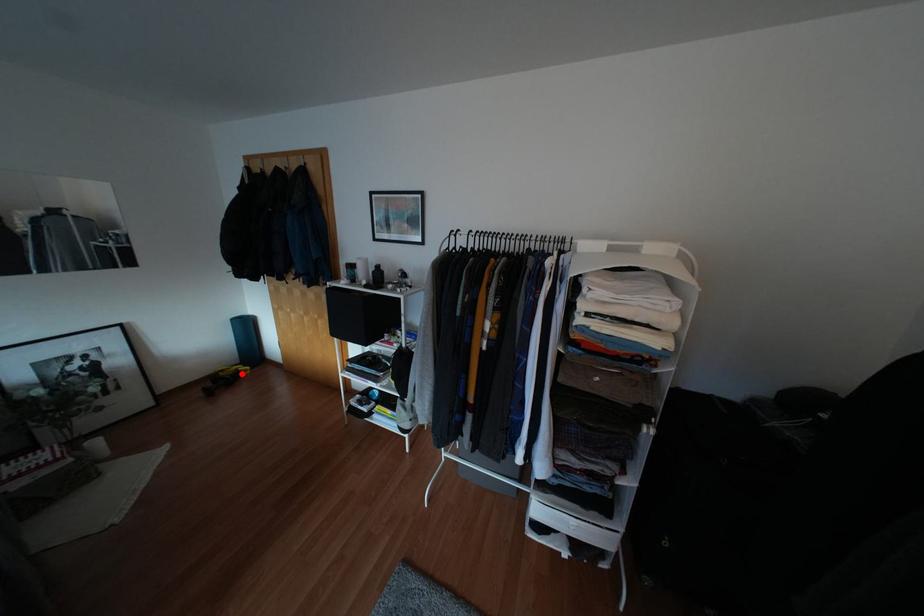
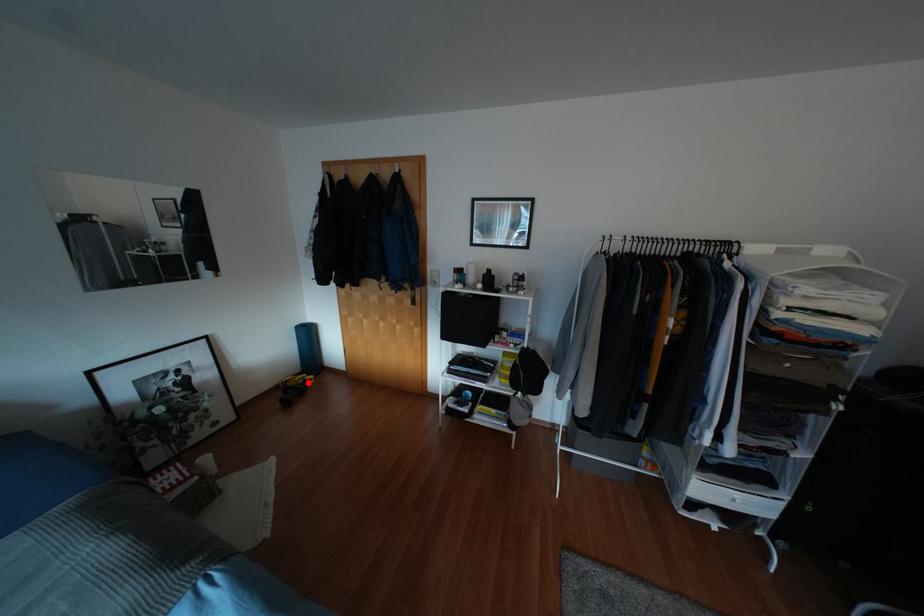
I am providing you with two images of the same scene from different viewpoints. A red point is marked on the first image and another point is marked on the second image. Does the point marked in image1 correspond to the same location as the one in image2?

Yes